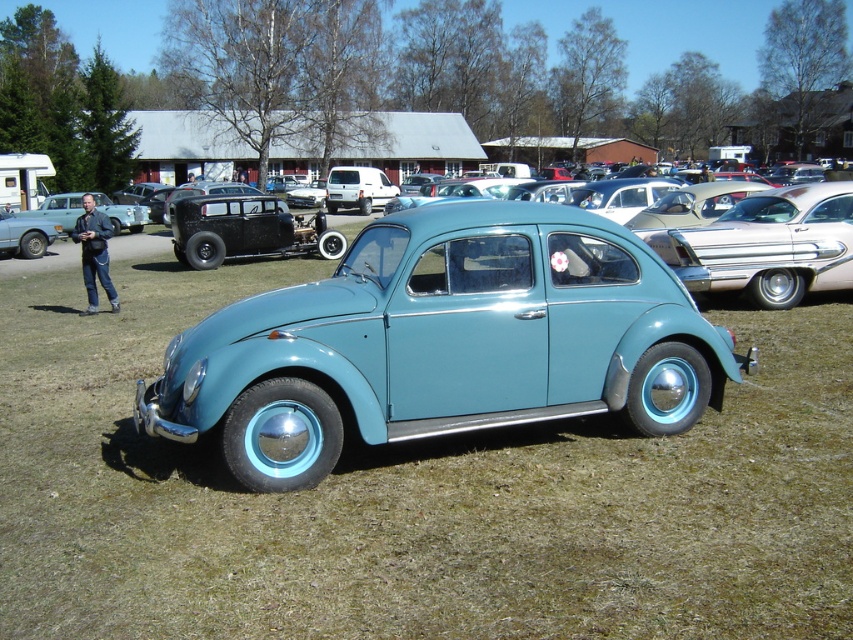
Between shiny silver sedan at right and matte black car at left, which one appears on the right side from the viewer's perspective?

From the viewer's perspective, shiny silver sedan at right appears more on the right side.

Does point (831, 260) come farther from viewer compared to point (131, 221)?

No, (831, 260) is in front of (131, 221).

Between point (793, 294) and point (138, 205), which one is positioned in front?

Point (793, 294) is more forward.

The width and height of the screenshot is (853, 640). What are the coordinates of `shiny silver sedan at right` in the screenshot? It's located at (769, 244).

Between point (448, 358) and point (666, 262), which one is positioned behind?

The point (666, 262) is more distant.

What do you see at coordinates (444, 342) in the screenshot? The height and width of the screenshot is (640, 853). I see `light blue matte car at center` at bounding box center [444, 342].

I want to click on light blue matte car at center, so click(x=444, y=342).

Which is more to the left, light blue matte car at center or matte black car at left?

matte black car at left is more to the left.

Who is positioned more to the right, light blue matte car at center or matte black car at left?

light blue matte car at center

Who is more forward, (700, 321) or (96, 195)?

Point (700, 321) is in front.

This screenshot has height=640, width=853. In order to click on light blue matte car at center in this screenshot , I will do pos(444,342).